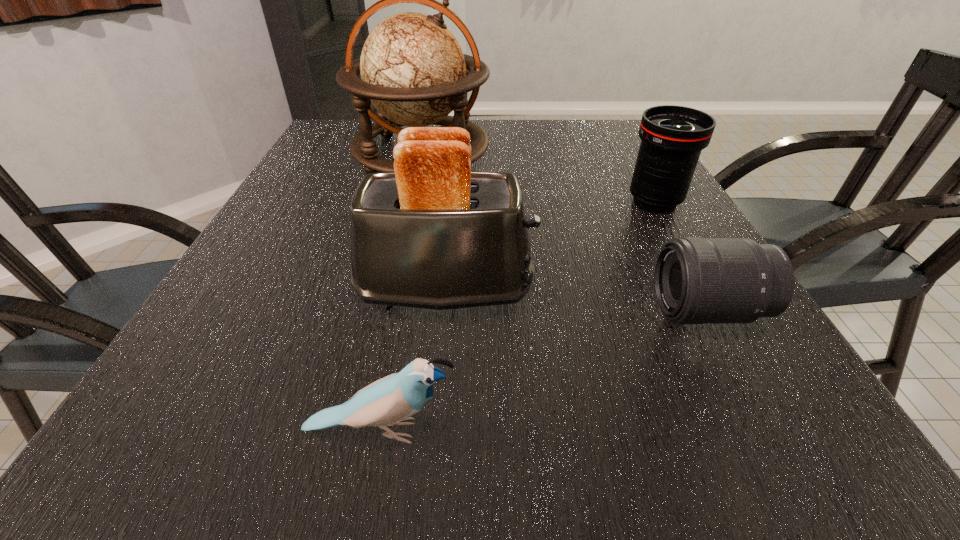
Where is `free spot located 0.260m at the face of the bird`? free spot located 0.260m at the face of the bird is located at coordinates (658, 431).

Identify the location of vacant space located 0.260m on the surface of the nearer telephoto lens. The image size is (960, 540). (501, 311).

Image resolution: width=960 pixels, height=540 pixels. Find the location of `vacant space located 0.050m on the surface of the nearer telephoto lens`. vacant space located 0.050m on the surface of the nearer telephoto lens is located at coordinates (627, 311).

Find the location of `vacant area located 0.190m on the surface of the nearer telephoto lens`. vacant area located 0.190m on the surface of the nearer telephoto lens is located at coordinates (542, 311).

Where is `object at the far edge`? The height and width of the screenshot is (540, 960). object at the far edge is located at coordinates (413, 71).

At what (x,y) coordinates should I click in order to perform the action: click on object that is at the near edge. Please return your answer as a coordinate pair (x, y). This screenshot has height=540, width=960. Looking at the image, I should click on 390,401.

Where is `object situated at the left edge`? object situated at the left edge is located at coordinates (413, 71).

Locate an element on the screen. The width and height of the screenshot is (960, 540). object at the far left corner is located at coordinates (413, 71).

The image size is (960, 540). I want to click on free region at the far edge of the desktop, so coord(564,143).

Locate an element on the screen. This screenshot has width=960, height=540. free spot at the near edge of the desktop is located at coordinates (655, 403).